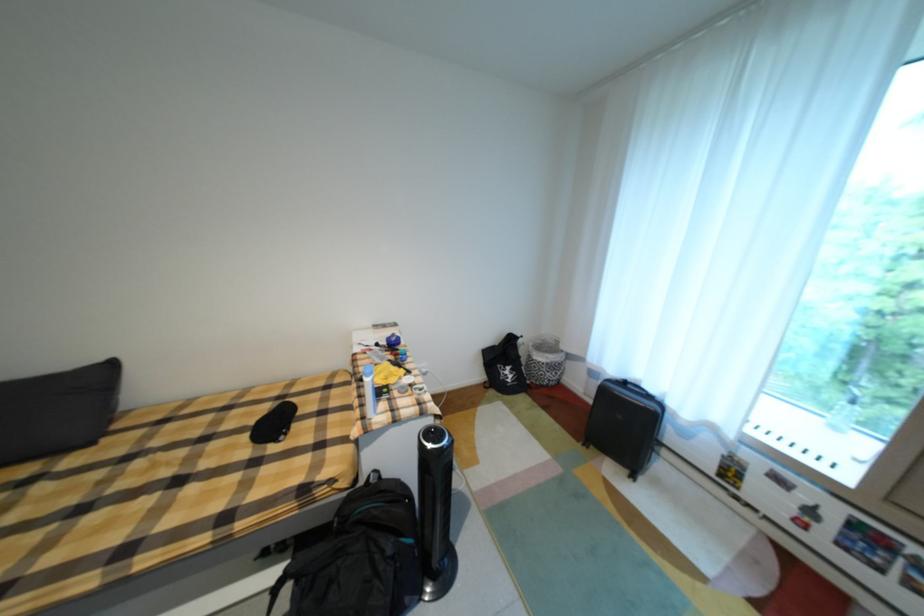
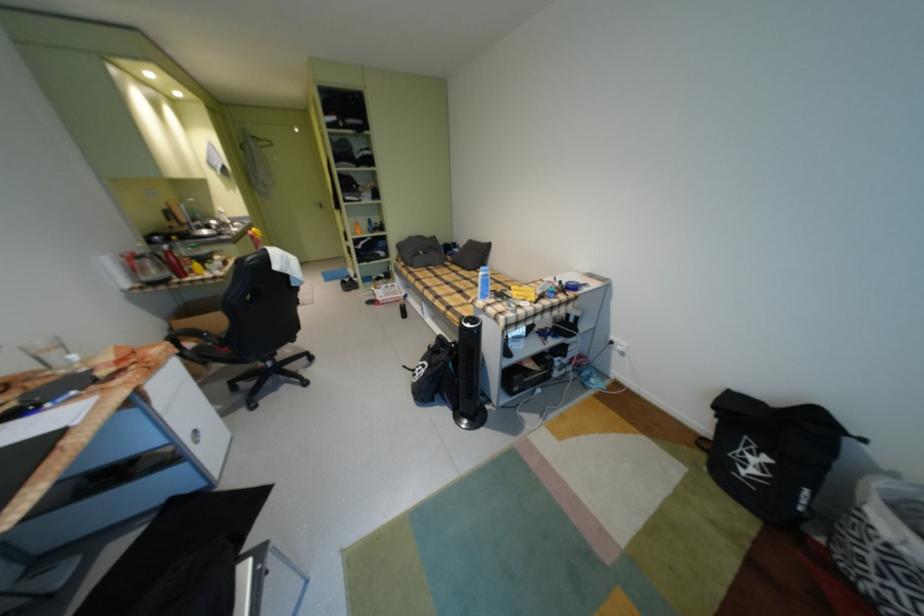
Find the pixel in the second image that matches point (518, 384) in the first image.

(748, 474)